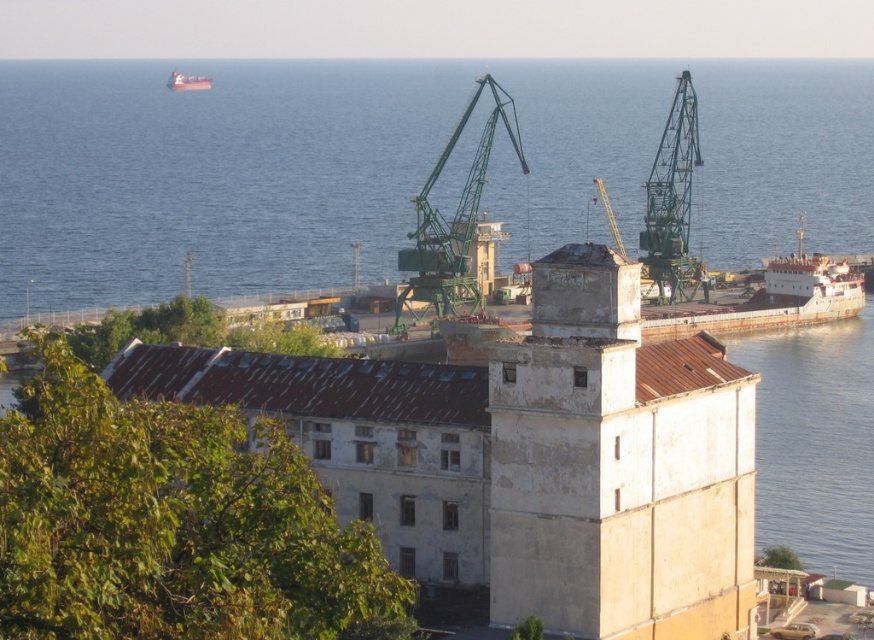
Question: Among these points, which one is farthest from the camera?

Choices:
 (A) (682, 170)
 (B) (599, 584)
 (C) (205, 81)
 (D) (437, 214)

Answer: (C)

Question: Can you confirm if white concrete tower at center is positioned to the left of green metallic crane at upper right?

Choices:
 (A) yes
 (B) no

Answer: (A)

Question: Which point is farther to the camera?

Choices:
 (A) [671, 292]
 (B) [716, 628]
 (C) [191, 83]
 (D) [429, 257]

Answer: (C)

Question: Does green metallic crane at upper right come behind white matte boat at upper left?

Choices:
 (A) yes
 (B) no

Answer: (B)

Question: Where is green metallic crane at center located in relation to white matte boat at upper left in the image?

Choices:
 (A) below
 (B) above

Answer: (A)

Question: Which of the following is the farthest from the observer?

Choices:
 (A) white matte boat at upper left
 (B) white concrete tower at center
 (C) green metallic crane at upper right
 (D) green metallic crane at center

Answer: (A)